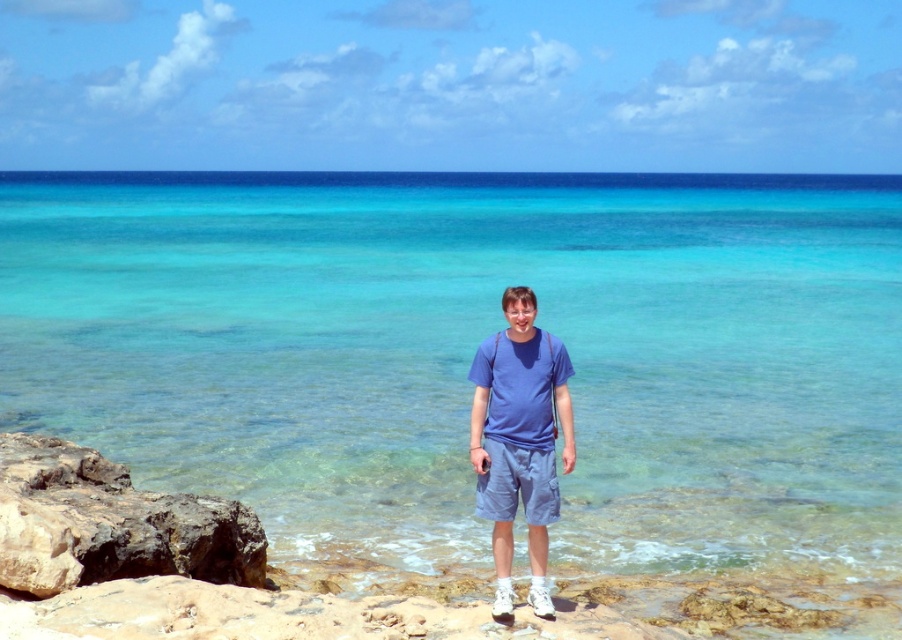
Is dark gray rock at lower left thinner than blue cotton shirt at center?

In fact, dark gray rock at lower left might be wider than blue cotton shirt at center.

Can you confirm if dark gray rock at lower left is positioned above blue cotton shirt at center?

No.

Is point (241, 557) positioned behind point (505, 609)?

That is True.

This screenshot has width=902, height=640. Find the location of `dark gray rock at lower left`. dark gray rock at lower left is located at coordinates (109, 524).

Who is more distant from viewer, (208, 403) or (507, 531)?

The point (208, 403) is more distant.

Between clear blue water at center and blue cotton shirt at center, which one is positioned lower?

blue cotton shirt at center is below.

Measure the distance between clear blue water at center and camera.

clear blue water at center and camera are 7.03 meters apart from each other.

The width and height of the screenshot is (902, 640). Find the location of `clear blue water at center`. clear blue water at center is located at coordinates (472, 355).

Describe the element at coordinates (472, 355) in the screenshot. I see `clear blue water at center` at that location.

Locate an element on the screen. The image size is (902, 640). clear blue water at center is located at coordinates (472, 355).